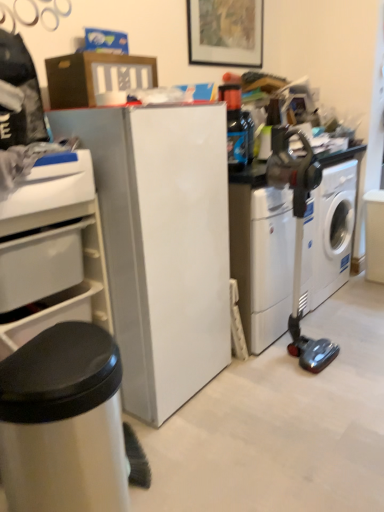
Identify the location of empty space that is ontop of silver metallic trash can at lower left. (39, 361).